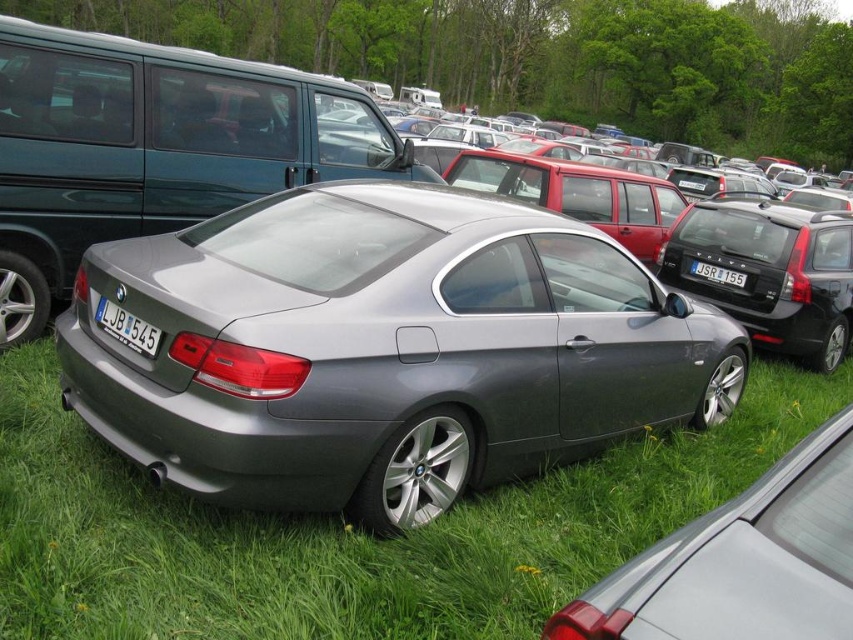
Question: Which object is positioned farthest from the black plastic license plate at center?

Choices:
 (A) green grass at center
 (B) white plastic license plate at center
 (C) satin metallic car at center

Answer: (B)

Question: Which object is closer to the camera taking this photo?

Choices:
 (A) satin metallic car at lower center
 (B) black plastic license plate at center

Answer: (A)

Question: Is green grass at center smaller than satin metallic car at lower center?

Choices:
 (A) yes
 (B) no

Answer: (B)

Question: Is green grass at center below white plastic license plate at center?

Choices:
 (A) no
 (B) yes

Answer: (B)

Question: Does satin metallic car at lower center have a greater width compared to white plastic license plate at center?

Choices:
 (A) yes
 (B) no

Answer: (A)

Question: Among these points, which one is farthest from the camera?

Choices:
 (A) (828, 340)
 (B) (403, 513)

Answer: (A)